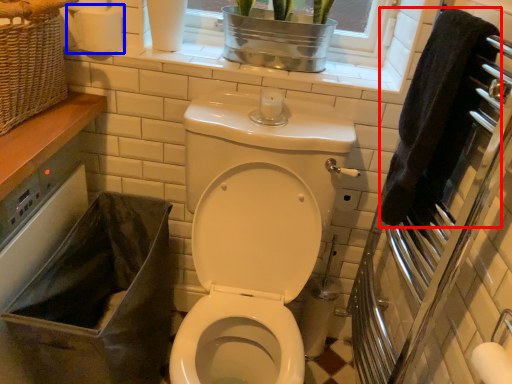
Question: Which point is closer to the camera, hand towel (highlighted by a red box) or toilet paper (highlighted by a blue box)?

Choices:
 (A) hand towel
 (B) toilet paper

Answer: (A)